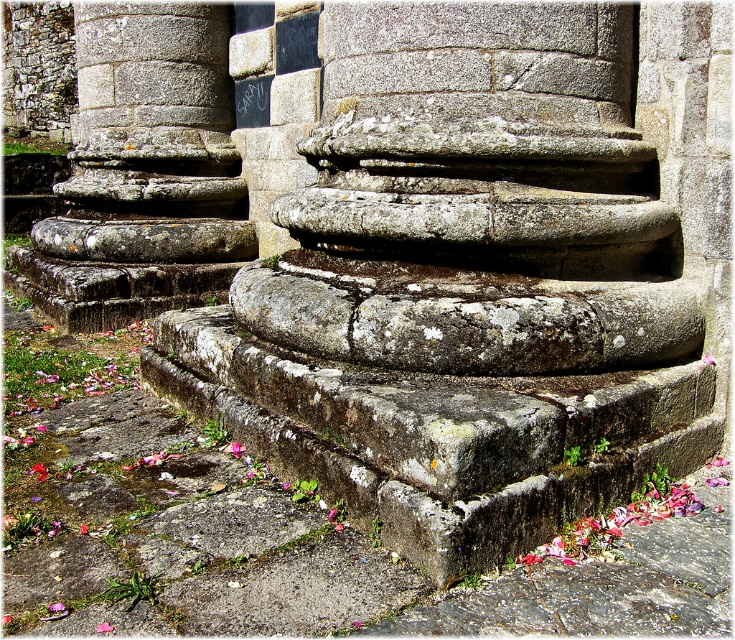
Question: Does gray stone stairs at center have a greater width compared to granite steps at center?

Choices:
 (A) yes
 (B) no

Answer: (A)

Question: Is gray stone stairs at center to the left of granite steps at center from the viewer's perspective?

Choices:
 (A) yes
 (B) no

Answer: (B)

Question: Among these points, which one is nearest to the camera?

Choices:
 (A) (76, 61)
 (B) (190, 401)

Answer: (B)

Question: Can you confirm if gray stone stairs at center is thinner than granite steps at center?

Choices:
 (A) no
 (B) yes

Answer: (A)

Question: Which of the following is the closest to the observer?

Choices:
 (A) granite steps at center
 (B) gray stone stairs at center

Answer: (B)